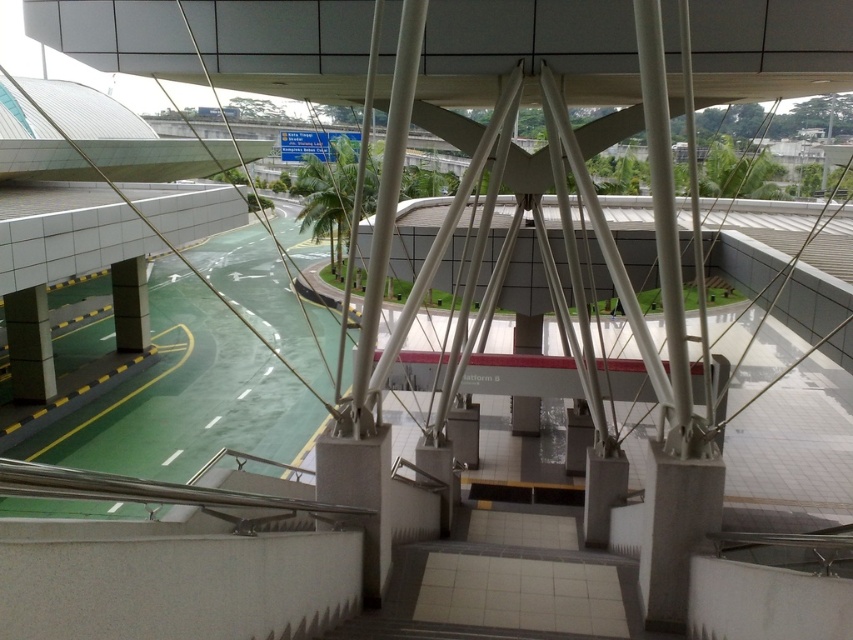
Question: Can you confirm if white concrete pillar at center is wider than matte gray pillar at lower left?

Choices:
 (A) yes
 (B) no

Answer: (B)

Question: Is green leafy palm tree at center wider than matte gray pillar at center?

Choices:
 (A) no
 (B) yes

Answer: (B)

Question: Which point is closer to the camera?

Choices:
 (A) (32, 296)
 (B) (363, 172)

Answer: (B)

Question: Which object is the closest to the white concrete pillar at center?

Choices:
 (A) green leafy palm tree at center
 (B) matte gray pillar at center
 (C) matte gray pillar at lower left

Answer: (C)

Question: Which of these objects is positioned closest to the matte gray pillar at lower left?

Choices:
 (A) white concrete pillar at center
 (B) green leafy palm tree at center
 (C) matte gray pillar at center

Answer: (C)

Question: Is green leafy palm tree at center positioned behind matte gray pillar at lower left?

Choices:
 (A) yes
 (B) no

Answer: (B)